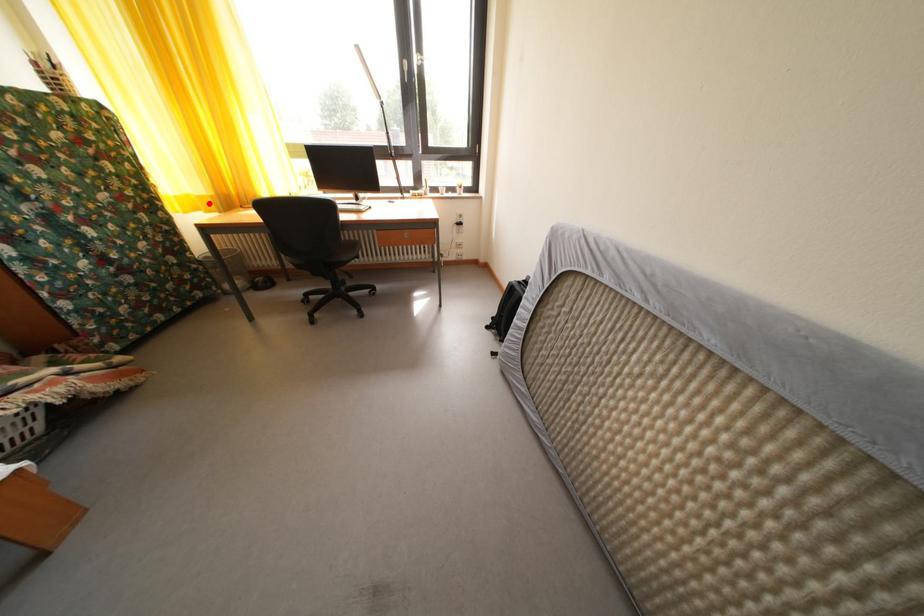
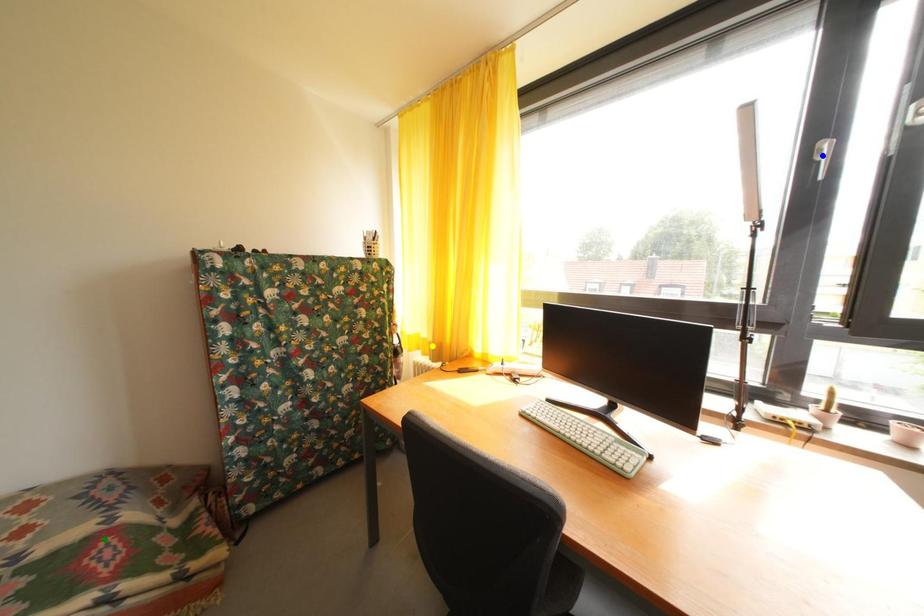
Question: I am providing you with two images of the same scene from different viewpoints. A red point is marked on the first image. You are given multiple points on the second image. Which point in image 2 represents the same 3d spot as the red point in image 1?

Choices:
 (A) blue point
 (B) yellow point
 (C) green point

Answer: (B)